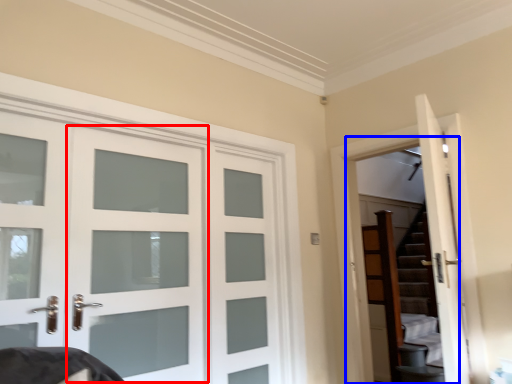
Question: Which point is closer to the camera, screen door (highlighted by a red box) or garage door (highlighted by a blue box)?

Choices:
 (A) screen door
 (B) garage door

Answer: (A)